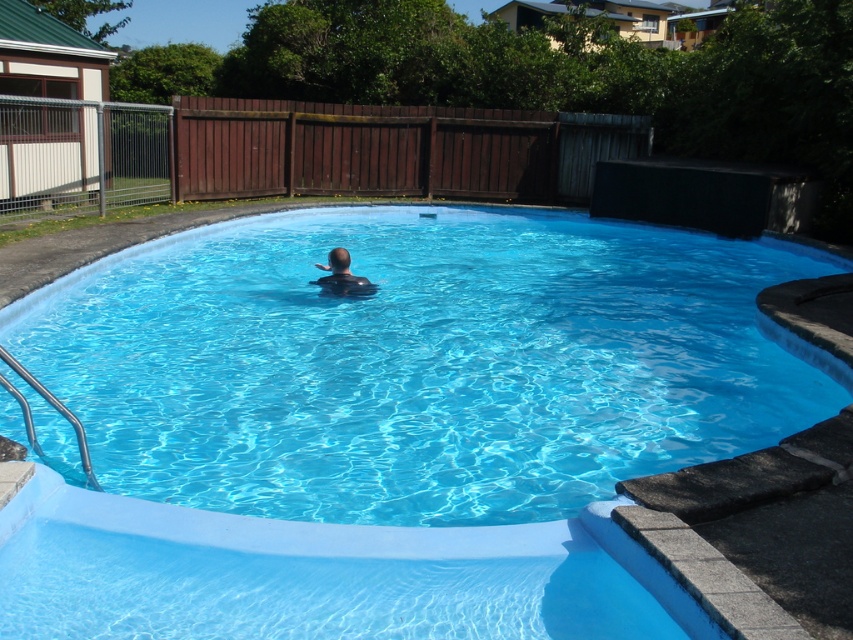
Question: Which of the following is the farthest from the observer?

Choices:
 (A) (572, 232)
 (B) (345, 253)

Answer: (A)

Question: Which point is closer to the camera taking this photo?

Choices:
 (A) (664, 337)
 (B) (337, 262)

Answer: (A)

Question: Is blue smooth pool at center positioned behind dark blue skin at center?

Choices:
 (A) no
 (B) yes

Answer: (A)

Question: Is blue smooth pool at center bigger than dark blue skin at center?

Choices:
 (A) no
 (B) yes

Answer: (B)

Question: Which object is farther from the camera taking this photo?

Choices:
 (A) blue smooth pool at center
 (B) dark blue skin at center

Answer: (B)

Question: Can you confirm if blue smooth pool at center is positioned to the left of dark blue skin at center?

Choices:
 (A) yes
 (B) no

Answer: (B)